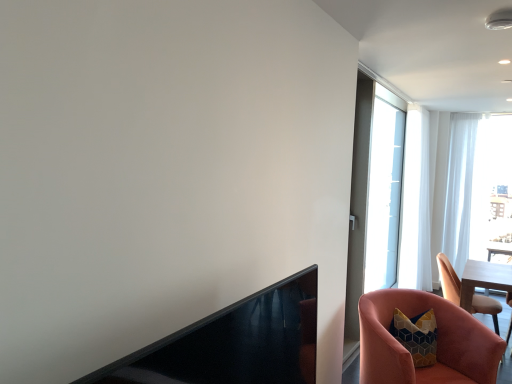
Question: Is pink velvet chair at lower right, the 1th chair from the back, thinner than transparent glass screen door at upper right?

Choices:
 (A) no
 (B) yes

Answer: (A)

Question: Is pink velvet chair at lower right, which ranks as the 1th chair in right-to-left order, next to transparent glass screen door at upper right?

Choices:
 (A) no
 (B) yes

Answer: (A)

Question: Is pink velvet chair at lower right, which ranks as the 1th chair in right-to-left order, shorter than transparent glass screen door at upper right?

Choices:
 (A) yes
 (B) no

Answer: (A)

Question: Is pink velvet chair at lower right, which ranks as the 1th chair in right-to-left order, bigger than transparent glass screen door at upper right?

Choices:
 (A) yes
 (B) no

Answer: (B)

Question: From the image's perspective, is pink velvet chair at lower right, the 2th chair in the front-to-back sequence, on top of transparent glass screen door at upper right?

Choices:
 (A) no
 (B) yes

Answer: (A)

Question: From the image's perspective, is black glossy fireplace at lower left above or below transparent glass screen door at upper right?

Choices:
 (A) below
 (B) above

Answer: (A)

Question: Considering their positions, is black glossy fireplace at lower left located in front of or behind transparent glass screen door at upper right?

Choices:
 (A) behind
 (B) front

Answer: (B)

Question: Is point (198, 352) closer or farther from the camera than point (365, 125)?

Choices:
 (A) closer
 (B) farther

Answer: (A)

Question: Is black glossy fireplace at lower left wider or thinner than transparent glass screen door at upper right?

Choices:
 (A) wide
 (B) thin

Answer: (A)

Question: Is pink velvet chair at lower right, which is the 2th chair in left-to-right order, bigger or smaller than white sheer curtain at right, placed as the second curtain when sorted from left to right?

Choices:
 (A) big
 (B) small

Answer: (B)

Question: From a real-world perspective, is pink velvet chair at lower right, which is the 2th chair in left-to-right order, physically located above or below white sheer curtain at right, placed as the second curtain when sorted from left to right?

Choices:
 (A) below
 (B) above

Answer: (A)

Question: In the image, is pink velvet chair at lower right, which is the 2th chair in left-to-right order, positioned in front of or behind white sheer curtain at right, placed as the second curtain when sorted from left to right?

Choices:
 (A) front
 (B) behind

Answer: (A)

Question: Is pink velvet chair at lower right, which is the 2th chair in left-to-right order, wider or thinner than white sheer curtain at right, which is the 1th curtain from right to left?

Choices:
 (A) thin
 (B) wide

Answer: (B)

Question: From a real-world perspective, is black glossy fireplace at lower left above or below pink velvet chair at lower right, the 1th chair viewed from the front?

Choices:
 (A) below
 (B) above

Answer: (B)

Question: Is point (266, 334) positioned closer to the camera than point (464, 357)?

Choices:
 (A) closer
 (B) farther

Answer: (A)